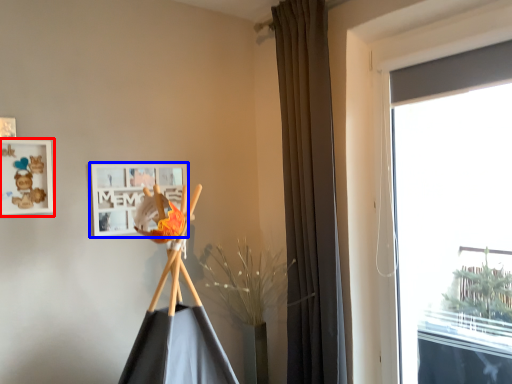
Question: Which object is further to the camera taking this photo, picture frame (highlighted by a red box) or picture frame (highlighted by a blue box)?

Choices:
 (A) picture frame
 (B) picture frame

Answer: (B)